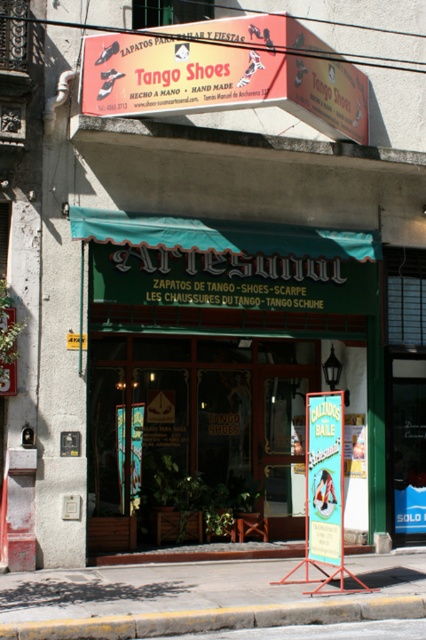
Question: Considering the real-world distances, which object is farthest from the green fabric sign at center?

Choices:
 (A) green wooden sign at center
 (B) red plastic signboard at upper center

Answer: (B)

Question: Can you confirm if red plastic signboard at upper center is positioned to the left of green fabric sign at center?

Choices:
 (A) no
 (B) yes

Answer: (B)

Question: In this image, where is yellow concrete curb at lower center located relative to green fabric sign at center?

Choices:
 (A) right
 (B) left

Answer: (B)

Question: Among these objects, which one is farthest from the camera?

Choices:
 (A) green fabric sign at center
 (B) yellow concrete curb at lower center
 (C) red plastic signboard at upper center

Answer: (C)

Question: In this image, where is green wooden sign at center located relative to red plastic signboard at upper center?

Choices:
 (A) below
 (B) above

Answer: (A)

Question: Which point is closer to the camera?

Choices:
 (A) green fabric sign at center
 (B) green wooden sign at center

Answer: (A)